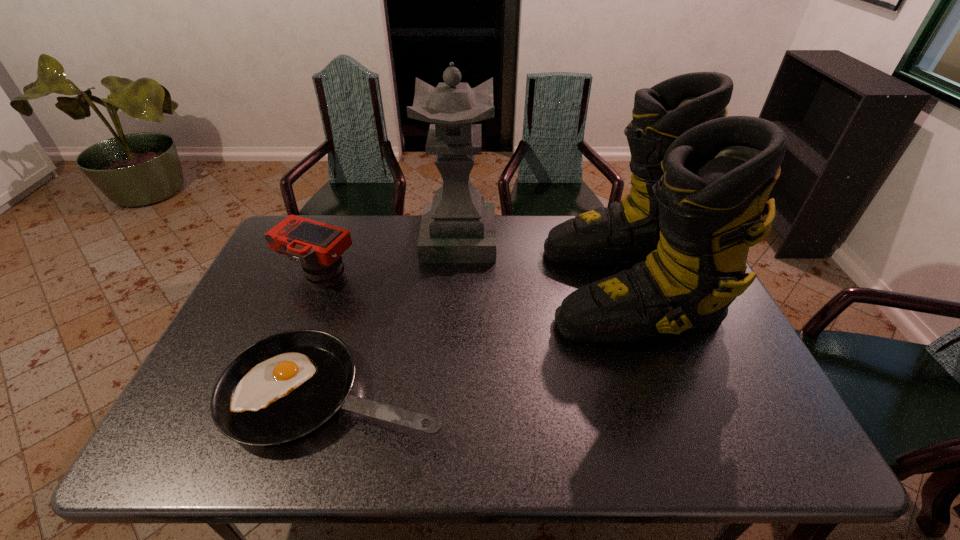
I want to click on vacant region between the frying pan and the ski boots, so click(481, 340).

Identify which object is the third nearest to the second shortest object. Please provide its 2D coordinates. Your answer should be formatted as a tuple, i.e. [(x, y)], where the tuple contains the x and y coordinates of a point satisfying the conditions above.

[(700, 180)]

Choose which object is the third nearest neighbor to the rightmost object. Please provide its 2D coordinates. Your answer should be formatted as a tuple, i.e. [(x, y)], where the tuple contains the x and y coordinates of a point satisfying the conditions above.

[(318, 247)]

You are a GUI agent. You are given a task and a screenshot of the screen. Output one action in this format:
    pyautogui.click(x=<x>, y=<y>)
    Task: Click on the free space that satisfies the following two spatial constraints: 1. at the front opening of the sculpture; 2. on the front side of the camera
    The height and width of the screenshot is (540, 960).
    Given the screenshot: What is the action you would take?
    pyautogui.click(x=457, y=275)

Identify the location of vacant area in the image that satisfies the following two spatial constraints: 1. at the front opening of the sculpture; 2. on the front side of the shortest object. The width and height of the screenshot is (960, 540). (449, 393).